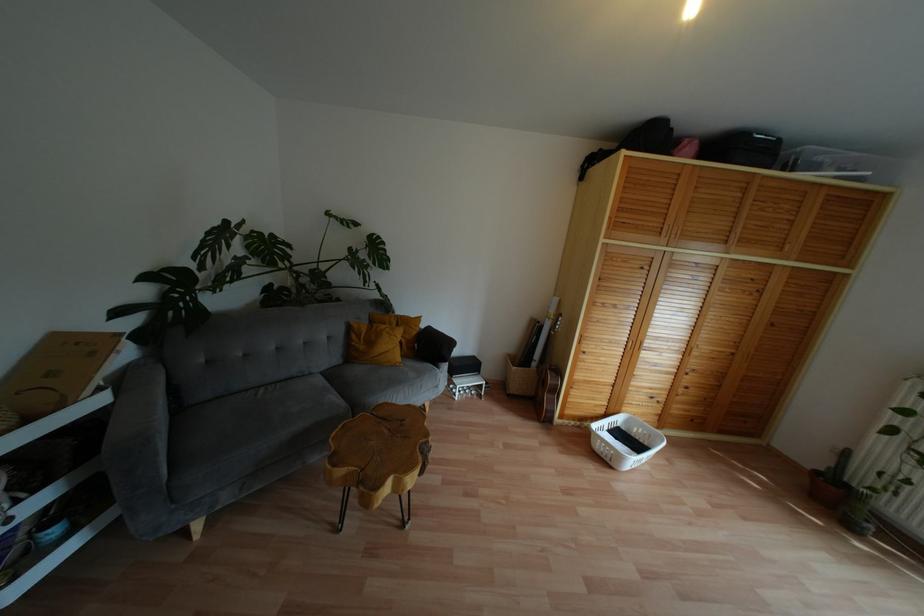
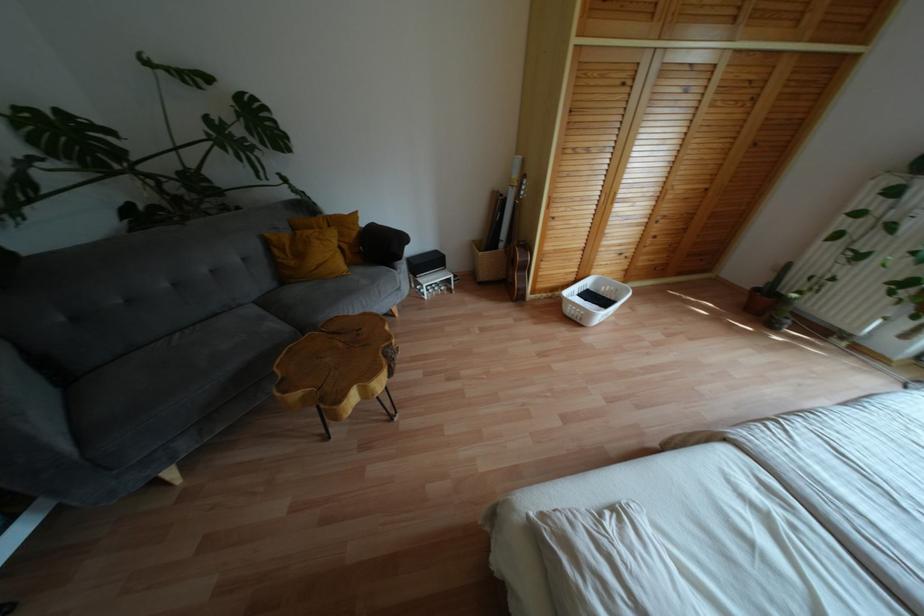
Find the pixel in the second image that matches the point at 554,391 in the first image.

(525, 267)